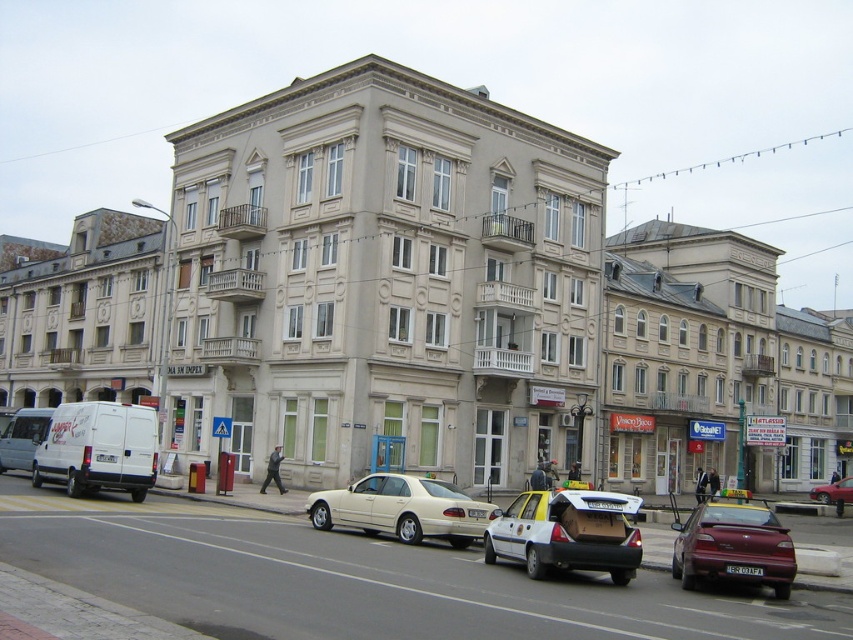
Consider the image. You are a delivery person who needs to load a large package into your vehicle. The package requires a taller vehicle trunk. Which vehicle between the matte beige sedan at center and the metallic silver sedan at center should you choose?

The metallic silver sedan at center has a greater height than the matte beige sedan at center, so you should choose the metallic silver sedan at center for the taller trunk.

You are a pedestrian standing on the sidewalk across the street from the matte beige sedan at center and the metallic silver sedan at center. Which car is closer to you?

The matte beige sedan at center is closer to you because it is positioned over the metallic silver sedan at center, indicating it is in front.

You are a delivery driver needing to park your vehicle. You see a matte beige sedan at center and a metallic silver sedan at center. Which one is closer to the curb?

The matte beige sedan at center is closer to the curb because it is in front of the metallic silver sedan at center.